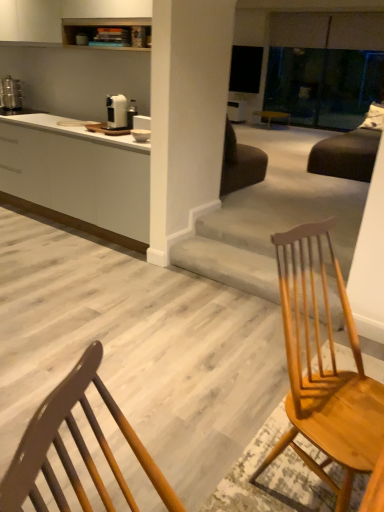
Question: Is metallic silver toaster at left, arranged as the 2th appliance when viewed from the front, at the back of satin silver toaster at upper center, which is the first appliance from bottom to top?

Choices:
 (A) yes
 (B) no

Answer: (B)

Question: Is satin silver toaster at upper center, placed as the first appliance when sorted from front to back, bigger than metallic silver toaster at left, arranged as the 2th appliance when viewed from the front?

Choices:
 (A) yes
 (B) no

Answer: (B)

Question: Can you confirm if satin silver toaster at upper center, the 2th appliance from the back, is taller than metallic silver toaster at left, arranged as the 2th appliance when viewed from the front?

Choices:
 (A) yes
 (B) no

Answer: (B)

Question: Are satin silver toaster at upper center, placed as the 2th appliance when sorted from left to right, and metallic silver toaster at left, marked as the second appliance in a right-to-left arrangement, far apart?

Choices:
 (A) no
 (B) yes

Answer: (B)

Question: Is satin silver toaster at upper center, the 2th appliance from the back, at the right side of metallic silver toaster at left, which is counted as the first appliance, starting from the back?

Choices:
 (A) yes
 (B) no

Answer: (A)

Question: From the image's perspective, is light brown wood chair at center positioned above or below white matte cabinet at left?

Choices:
 (A) below
 (B) above

Answer: (A)

Question: Looking at the image, does light brown wood chair at center seem bigger or smaller compared to white matte cabinet at left?

Choices:
 (A) small
 (B) big

Answer: (A)

Question: From a real-world perspective, is light brown wood chair at center above or below white matte cabinet at left?

Choices:
 (A) below
 (B) above

Answer: (B)

Question: Considering the positions of point (309, 265) and point (137, 190), is point (309, 265) closer or farther from the camera than point (137, 190)?

Choices:
 (A) farther
 (B) closer

Answer: (B)

Question: In terms of width, does satin silver toaster at upper center, placed as the 2th appliance when sorted from left to right, look wider or thinner when compared to metallic silver toaster at left, which is counted as the first appliance, starting from the back?

Choices:
 (A) thin
 (B) wide

Answer: (A)

Question: From the image's perspective, is satin silver toaster at upper center, the second appliance viewed from the top, above or below metallic silver toaster at left, which is counted as the first appliance, starting from the back?

Choices:
 (A) above
 (B) below

Answer: (B)

Question: Is point (114, 101) closer or farther from the camera than point (13, 80)?

Choices:
 (A) closer
 (B) farther

Answer: (A)

Question: In the image, is satin silver toaster at upper center, placed as the first appliance when sorted from front to back, positioned in front of or behind metallic silver toaster at left, arranged as the 2th appliance when viewed from the front?

Choices:
 (A) front
 (B) behind

Answer: (A)

Question: In terms of size, does metallic silver toaster at left, arranged as the 2th appliance when viewed from the front, appear bigger or smaller than white matte cabinet at left?

Choices:
 (A) big
 (B) small

Answer: (B)

Question: Considering the positions of metallic silver toaster at left, which is counted as the first appliance, starting from the back, and white matte cabinet at left in the image, is metallic silver toaster at left, which is counted as the first appliance, starting from the back, taller or shorter than white matte cabinet at left?

Choices:
 (A) short
 (B) tall

Answer: (A)